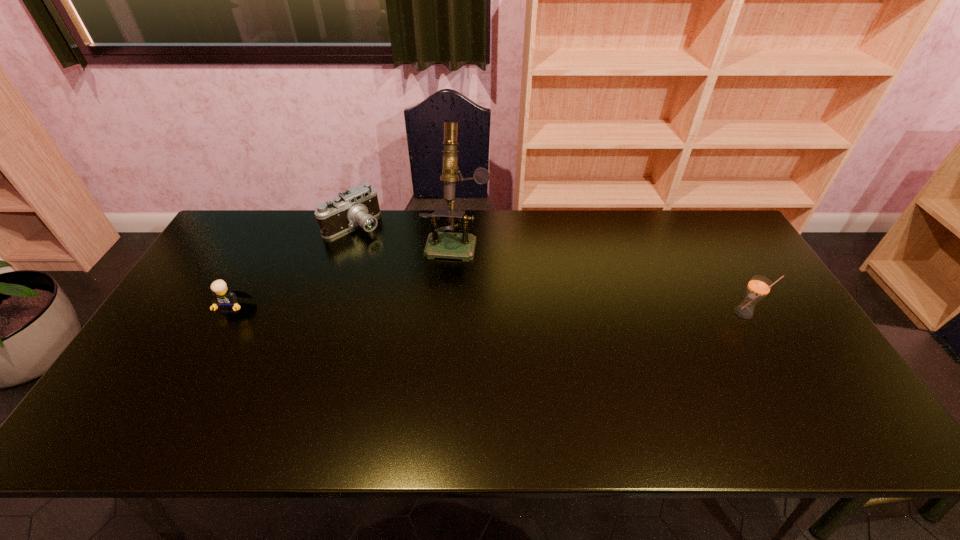
At what (x,y) coordinates should I click in order to perform the action: click on free spot on the desktop that is between the Lego and the straw and is positioned at the eyepiece of the tallest object. Please return your answer as a coordinate pair (x, y). The image size is (960, 540). Looking at the image, I should click on (442, 310).

You are a GUI agent. You are given a task and a screenshot of the screen. Output one action in this format:
    pyautogui.click(x=<x>, y=<y>)
    Task: Click on the vacant space on the desktop that is between the Lego and the rightmost object and is positioned at the lens of the camera
    The width and height of the screenshot is (960, 540).
    Given the screenshot: What is the action you would take?
    pyautogui.click(x=422, y=310)